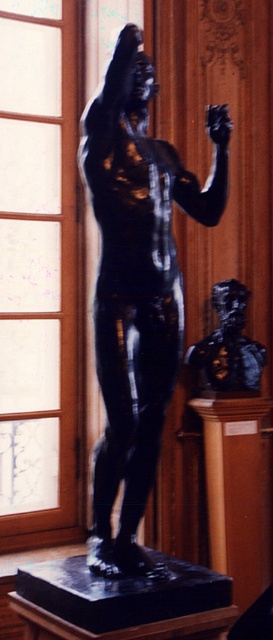
You are an art curator planning to move the black polished statue at center and the black polished bust at center to a new exhibition space. Since both are on the same pedestal, which one would you need to move first to access the other?

You need to move the black polished statue at center first because it is in front of the black polished bust at center, so moving it first will allow access to the bust behind.

You are standing in front of a gallery with a coordinate system where the bottom left corner is the origin point. The black polished statue at center is located at point 0.452, 0.502. If you want to move to the statue, which direction should you walk from your current position at point 0.3, 0.3?

To reach the black polished statue at center from point (81, 192), you should walk northeast because the statue is located at (137, 289), which is higher in both the x and y coordinates compared to your current position.

You are standing in front of the bronze sculpture and notice two points marked on it. The first point is at coordinates point (x=176, y=280) and the second is at point (x=221, y=291). Which point is closer to your eyes?

Point (x=176, y=280) is closer to the camera than point (x=221, y=291).